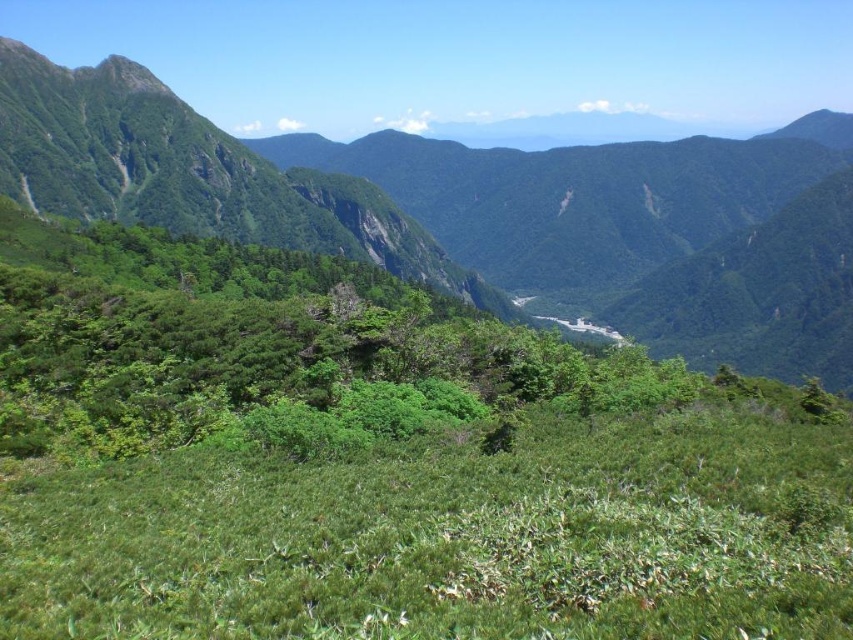
You are standing at the point labeled point (x=399, y=205) and want to reach the point labeled point (x=827, y=612). Based on the scene description, which direction should you move to get closer to your destination?

You should move forward because point (x=827, y=612) is in front of point (x=399, y=205), so moving forward will bring you closer to your destination.

You are standing in the meadow looking towards the mountains. You notice two areas of green leafy growth. One is labeled as green leafy grass at center and the other as green leafy vegetation at center. Which one is closer to you?

The green leafy grass at center is closer because it is positioned in front of the green leafy vegetation at center.

You are a hiker standing in the valley and want to cross to the meadow. You see the green leafy grass at center and the green leafy vegetation at center. Which one is shorter and easier to step over?

The green leafy grass at center is shorter than the green leafy vegetation at center, so it would be easier to step over.